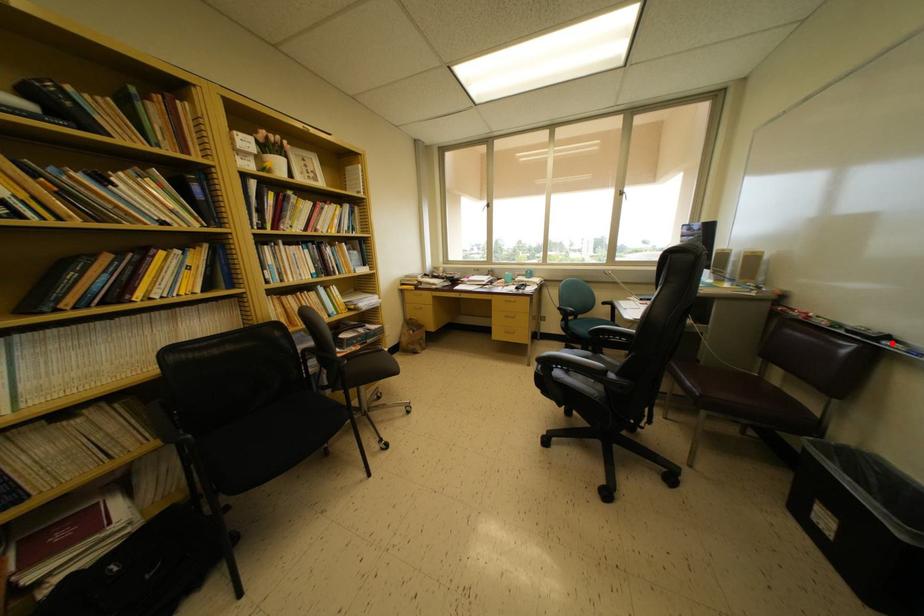
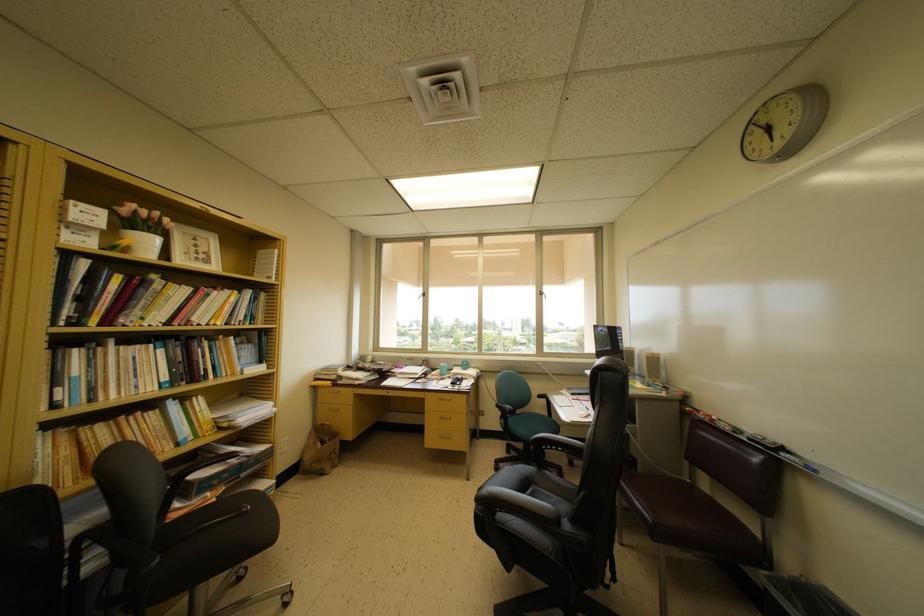
Find the pixel in the second image that matches the highlighted location in the first image.

(786, 454)